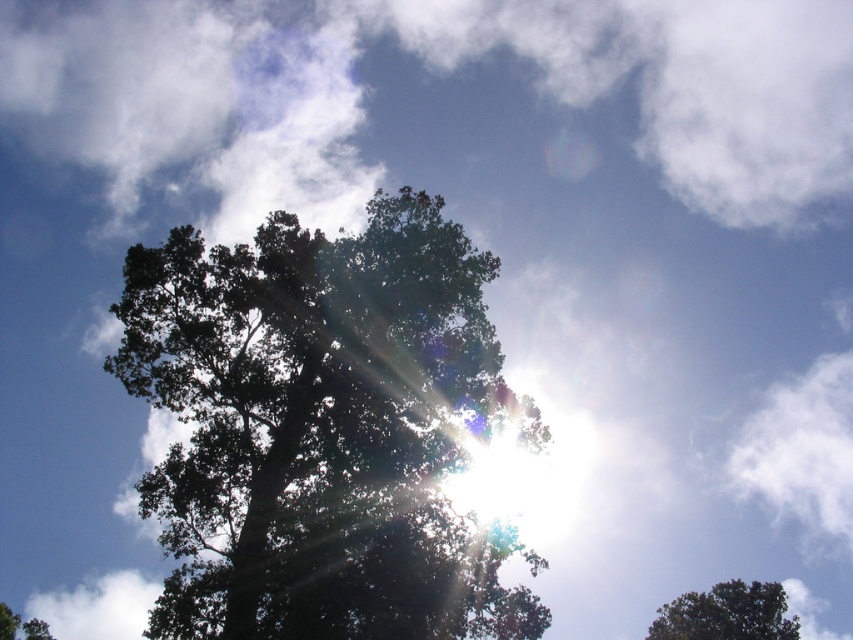
Does dark green leafy tree at center have a lesser height compared to green leafy tree at lower right?

No.

Is point (308, 531) positioned after point (732, 592)?

No, (308, 531) is in front of (732, 592).

This screenshot has height=640, width=853. Find the location of `dark green leafy tree at center`. dark green leafy tree at center is located at coordinates (320, 428).